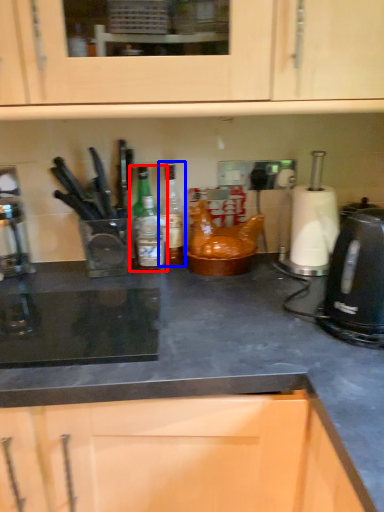
Question: Which of the following is the closest to the observer, kitchen appliance (highlighted by a red box) or bottle (highlighted by a blue box)?

Choices:
 (A) kitchen appliance
 (B) bottle

Answer: (A)